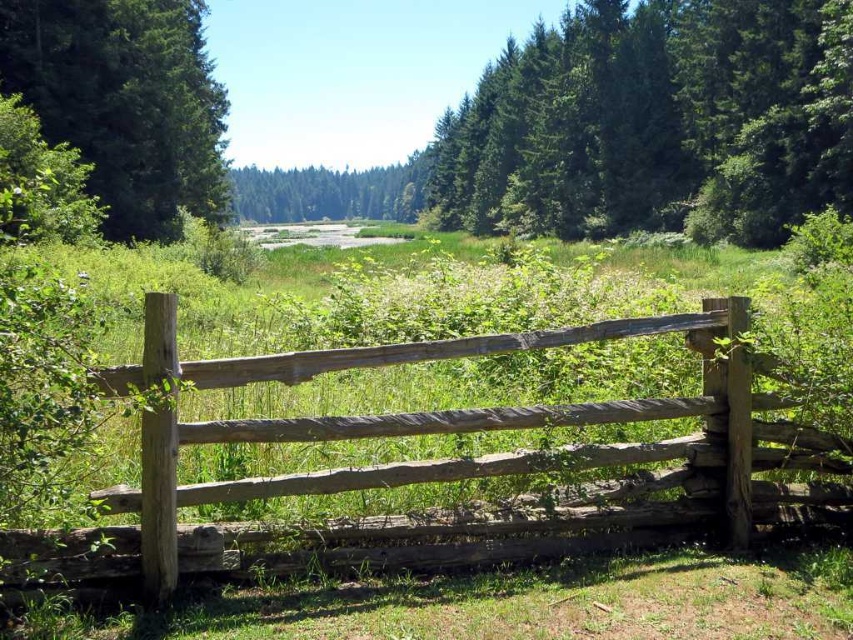
Question: Can you confirm if weathered wood fence at center is positioned to the left of green textured tree at upper left?

Choices:
 (A) yes
 (B) no

Answer: (B)

Question: Which of these objects is positioned farthest from the green matte tree at center?

Choices:
 (A) green textured tree at upper left
 (B) green textured tree at upper center
 (C) weathered wood fence at center

Answer: (C)

Question: Which point is farther from the camera taking this photo?

Choices:
 (A) (184, 563)
 (B) (648, 96)

Answer: (B)

Question: Is weathered wood fence at center wider than green textured tree at upper left?

Choices:
 (A) no
 (B) yes

Answer: (A)

Question: Which of the following is the farthest from the observer?

Choices:
 (A) green textured tree at upper left
 (B) green matte tree at center

Answer: (B)

Question: Is green textured tree at upper center below green matte tree at center?

Choices:
 (A) yes
 (B) no

Answer: (B)